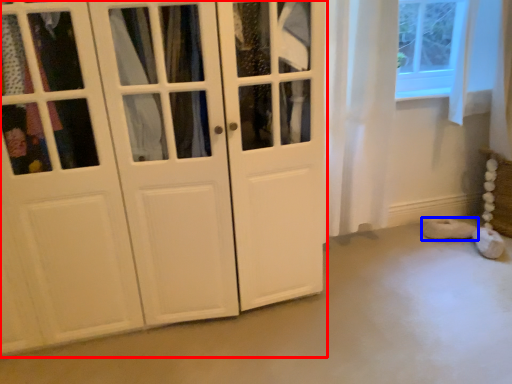
Question: Which object is further to the camera taking this photo, cupboard (highlighted by a red box) or footwear (highlighted by a blue box)?

Choices:
 (A) cupboard
 (B) footwear

Answer: (B)